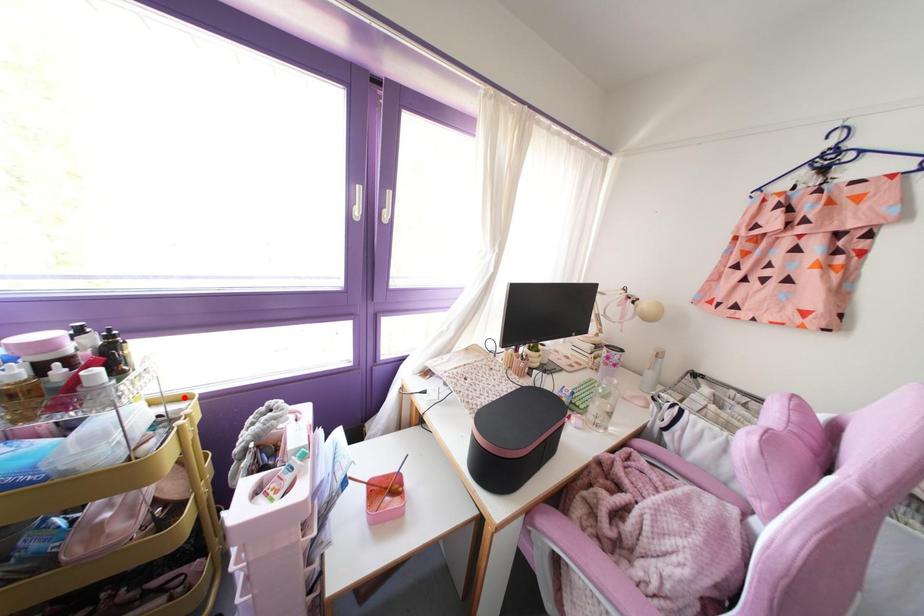
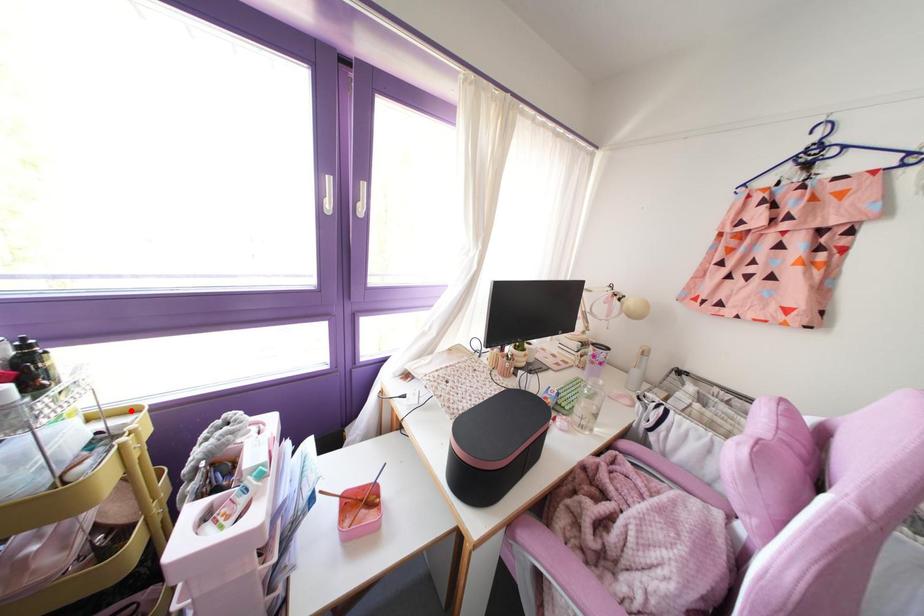
I am providing you with two images of the same scene from different viewpoints. A red point is marked on the first image and another point is marked on the second image. Do the highlighted points in image1 and image2 indicate the same real-world spot?

Yes